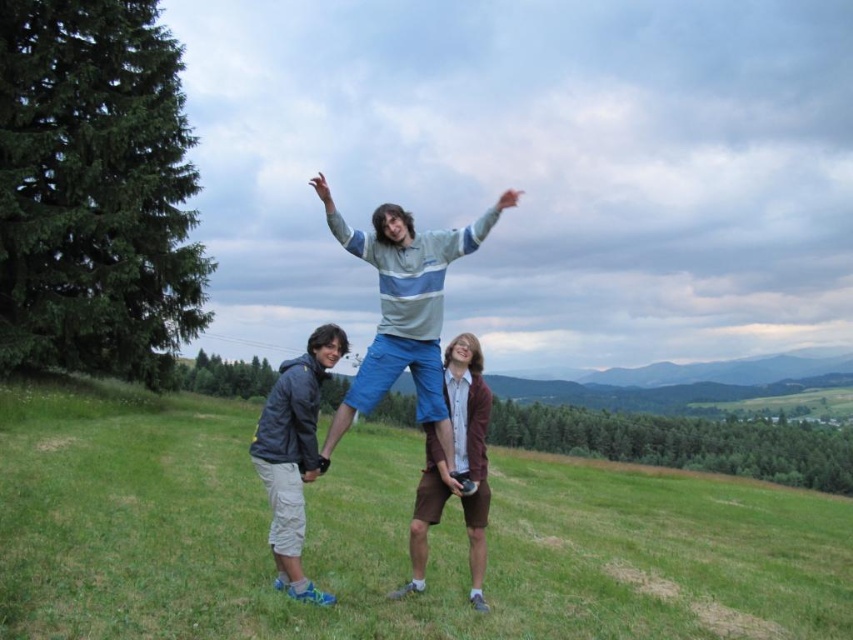
Based on the photo, does green grassy field at center have a smaller size compared to striped cotton shirt at center?

Actually, green grassy field at center might be larger than striped cotton shirt at center.

This screenshot has width=853, height=640. Describe the element at coordinates (384, 538) in the screenshot. I see `green grassy field at center` at that location.

Is point (212, 476) more distant than point (445, 436)?

Yes, point (212, 476) is behind point (445, 436).

Locate an element on the screen. The image size is (853, 640). green grassy field at center is located at coordinates (384, 538).

Who is higher up, striped cotton shirt at center or gray fabric jacket at lower left?

striped cotton shirt at center is above.

Can you confirm if striped cotton shirt at center is taller than gray fabric jacket at lower left?

Yes.

Image resolution: width=853 pixels, height=640 pixels. Describe the element at coordinates (403, 307) in the screenshot. I see `striped cotton shirt at center` at that location.

Find the location of a particular element. striped cotton shirt at center is located at coordinates (403, 307).

Is the position of green grassy field at center less distant than that of gray fabric jacket at lower left?

Yes, green grassy field at center is in front of gray fabric jacket at lower left.

Is green grassy field at center thinner than gray fabric jacket at lower left?

No.

This screenshot has height=640, width=853. Find the location of `green grassy field at center`. green grassy field at center is located at coordinates (384, 538).

Locate an element on the screen. green grassy field at center is located at coordinates (384, 538).